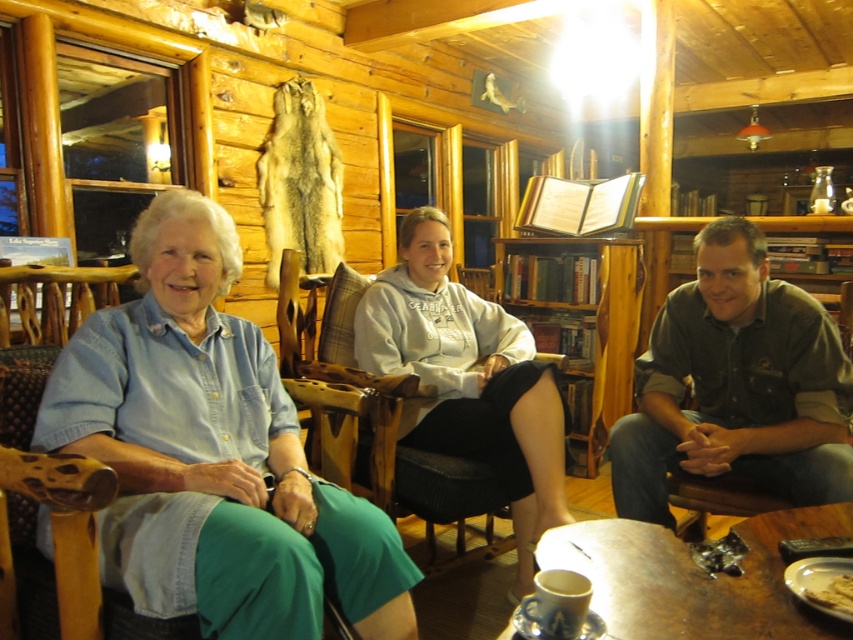
You are organizing a clothing donation drive and need to determine if the dark green shirt at center and the gray fleece sweatshirt at center can fit into a standard donation box that can hold items up to 12 inches in length. Given their sizes, will both items fit?

The dark green shirt at center has a smaller size compared to gray fleece sweatshirt at center. Since the standard donation box can hold items up to 12 inches in length, both items should fit as their sizes are likely within the limit.

You are standing in the cabin and want to move from point A to point B. Point A is at coordinate point (x=187, y=376) and point B is at coordinate point (x=850, y=602). Which point is closer to you?

Point A at coordinate point (x=187, y=376) is closer to you than point B at coordinate point (x=850, y=602).

You are planning to hang a picture frame on the wall between the denim shirt at left and the dark green shirt at center. The frame requires at least 1.2 meters of vertical space. Can the available space between these two shirts accommodate the frame?

The denim shirt at left is much taller than the dark green shirt at center. However, the exact height difference isn t specified, so we can t confirm if the vertical space between them meets the 1.2 meter requirement. Additional measurements would be needed.